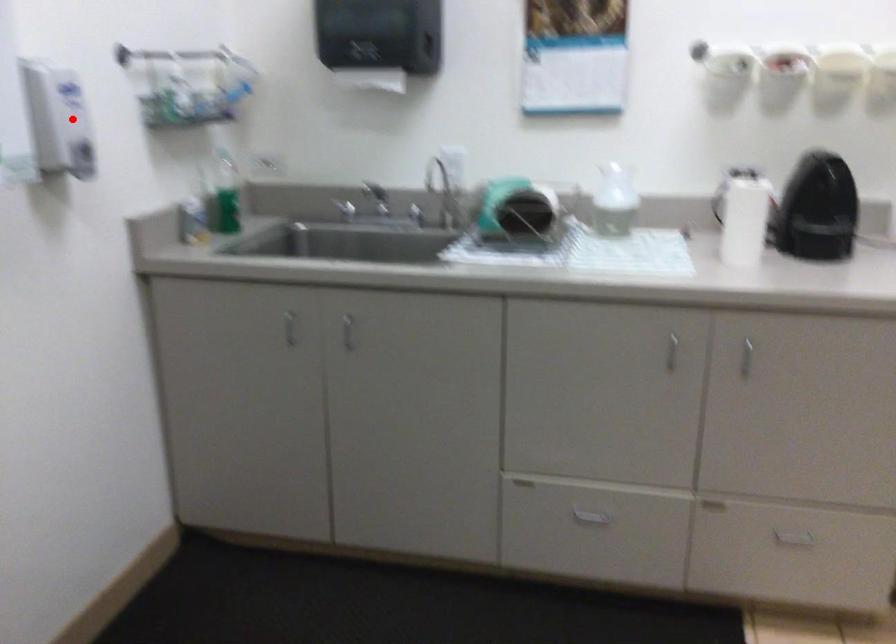
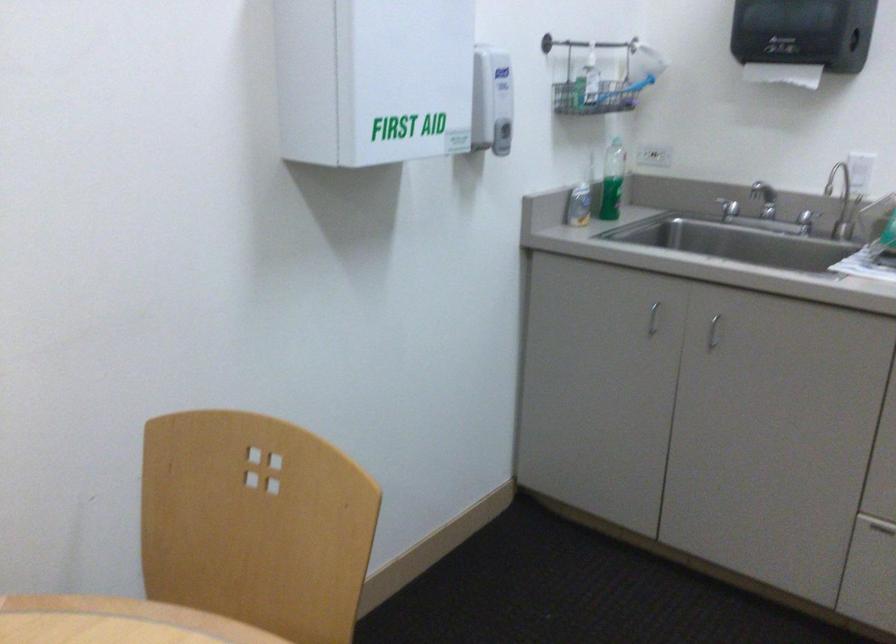
Where in the second image is the point corresponding to the highlighted location from the first image?

(492, 100)